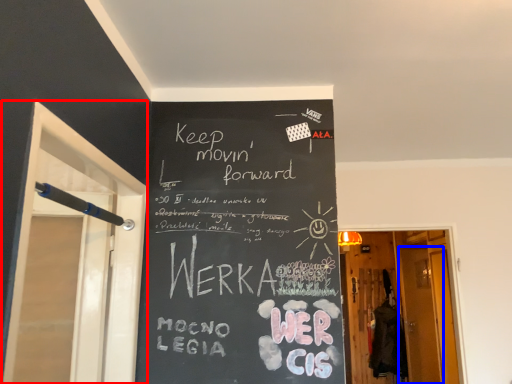
Question: Among these objects, which one is nearest to the camera, screen door (highlighted by a red box) or screen door (highlighted by a blue box)?

Choices:
 (A) screen door
 (B) screen door

Answer: (A)